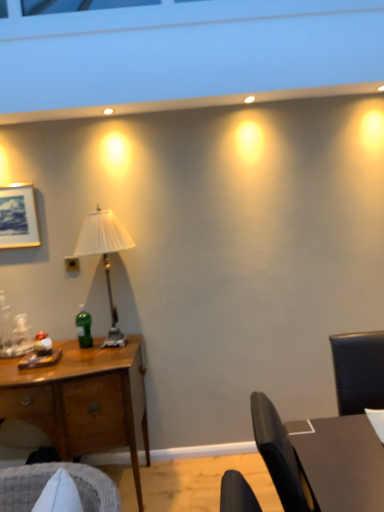
What do you see at coordinates (84, 328) in the screenshot? I see `green glass bottle at center-left` at bounding box center [84, 328].

What is the approximate width of white pleated fabric lampshade at left?

white pleated fabric lampshade at left is 36.72 centimeters wide.

What do you see at coordinates (72, 264) in the screenshot? I see `black plastic power outlet at center` at bounding box center [72, 264].

In order to click on wooden desk at left in this screenshot , I will do (x=84, y=400).

From the picture: From a real-world perspective, is dark brown wooden table at right under green glass bottle at center-left?

Yes.

Does dark brown wooden table at right turn towards green glass bottle at center-left?

No, dark brown wooden table at right does not turn towards green glass bottle at center-left.

Find the location of a particular element. The width and height of the screenshot is (384, 512). bottle on the left of dark brown wooden table at right is located at coordinates (84, 328).

Consider the image. Between dark brown wooden table at right and green glass bottle at center-left, which one has smaller size?

With smaller size is green glass bottle at center-left.

Looking at this image, is white pleated fabric lampshade at left further to the viewer compared to black plastic power outlet at center?

No, it is in front of black plastic power outlet at center.

The image size is (384, 512). I want to click on lamp below the black plastic power outlet at center (from a real-world perspective), so click(105, 256).

Which is in front, point (76, 255) or point (69, 263)?

The point (76, 255) is closer.

Who is taller, white pleated fabric lampshade at left or black plastic power outlet at center?

white pleated fabric lampshade at left is taller.

Is wooden desk at left to the left of white pleated fabric lampshade at left from the viewer's perspective?

Yes.

Which object is further away from the camera taking this photo, wooden desk at left or white pleated fabric lampshade at left?

white pleated fabric lampshade at left is more distant.

Is wooden desk at left far from white pleated fabric lampshade at left?

They are positioned close to each other.

Is wooden desk at left oriented towards white pleated fabric lampshade at left?

No, wooden desk at left is not aimed at white pleated fabric lampshade at left.

In the image, is wooden desk at left positioned in front of or behind black plastic power outlet at center?

Clearly, wooden desk at left is in front of black plastic power outlet at center.

Is point (53, 420) closer to camera compared to point (74, 266)?

Yes, point (53, 420) is closer to viewer.

Considering the relative sizes of wooden desk at left and black plastic power outlet at center in the image provided, is wooden desk at left taller than black plastic power outlet at center?

Yes.

Is black plastic power outlet at center positioned in front of dark brown wooden table at right?

No.

From a real-world perspective, which object stands above the other?

black plastic power outlet at center.

Identify the location of table in front of the black plastic power outlet at center. (341, 462).

How different are the orientations of black plastic power outlet at center and white pleated fabric lampshade at left in degrees?

They differ by 0.00145 degrees in their facing directions.

From a real-world perspective, is black plastic power outlet at center physically located above or below white pleated fabric lampshade at left?

In terms of real-world spatial position, black plastic power outlet at center is above white pleated fabric lampshade at left.

Which object is positioned more to the left, black plastic power outlet at center or white pleated fabric lampshade at left?

black plastic power outlet at center.

Is black plastic power outlet at center spatially inside white pleated fabric lampshade at left, or outside of it?

black plastic power outlet at center is outside white pleated fabric lampshade at left.

From the picture: Is wooden desk at left behind green glass bottle at center-left?

That is False.

Can you tell me how much wooden desk at left and green glass bottle at center-left differ in facing direction?

2.79 degrees.

Does wooden desk at left touch green glass bottle at center-left?

No, wooden desk at left is not next to green glass bottle at center-left.

The height and width of the screenshot is (512, 384). I want to click on desk in front of the green glass bottle at center-left, so click(x=84, y=400).

The width and height of the screenshot is (384, 512). I want to click on bottle to the left of dark brown wooden table at right, so click(x=84, y=328).

The image size is (384, 512). What are the coordinates of `power outlet that is above the white pleated fabric lampshade at left (from a real-world perspective)` in the screenshot? It's located at (72, 264).

Based on their spatial positions, is dark brown wooden table at right or white pleated fabric lampshade at left closer to wooden desk at left?

white pleated fabric lampshade at left is closer to wooden desk at left.

When comparing their distances from black plastic power outlet at center, does white pleated fabric lampshade at left or dark brown wooden table at right seem closer?

Among the two, white pleated fabric lampshade at left is located nearer to black plastic power outlet at center.

Considering their positions, is white pleated fabric lampshade at left positioned further to green glass bottle at center-left than dark brown wooden table at right?

Based on the image, dark brown wooden table at right appears to be further to green glass bottle at center-left.

Considering their positions, is dark brown wooden table at right positioned closer to black plastic power outlet at center than wooden desk at left?

wooden desk at left is positioned closer to the anchor black plastic power outlet at center.

Looking at the image, which one is located closer to green glass bottle at center-left, dark brown wooden table at right or white pleated fabric lampshade at left?

white pleated fabric lampshade at left lies closer to green glass bottle at center-left than the other object.

Which object lies nearer to the anchor point green glass bottle at center-left, dark brown wooden table at right or black plastic power outlet at center?

black plastic power outlet at center.

From the image, which object appears to be farther from green glass bottle at center-left, black plastic power outlet at center or white pleated fabric lampshade at left?

Among the two, black plastic power outlet at center is located further to green glass bottle at center-left.

Considering their positions, is green glass bottle at center-left positioned closer to dark brown wooden table at right than black plastic power outlet at center?

Among the two, green glass bottle at center-left is located nearer to dark brown wooden table at right.

At what (x,y) coordinates should I click in order to perform the action: click on bottle positioned between dark brown wooden table at right and black plastic power outlet at center from near to far. Please return your answer as a coordinate pair (x, y). This screenshot has width=384, height=512. Looking at the image, I should click on (84, 328).

Where is `desk positioned between dark brown wooden table at right and black plastic power outlet at center from near to far`? The width and height of the screenshot is (384, 512). desk positioned between dark brown wooden table at right and black plastic power outlet at center from near to far is located at coordinates (84, 400).

Where is `lamp between dark brown wooden table at right and black plastic power outlet at center from front to back`? lamp between dark brown wooden table at right and black plastic power outlet at center from front to back is located at coordinates (105, 256).

Where is `lamp between black plastic power outlet at center and green glass bottle at center-left in the up-down direction`? This screenshot has height=512, width=384. lamp between black plastic power outlet at center and green glass bottle at center-left in the up-down direction is located at coordinates (105, 256).